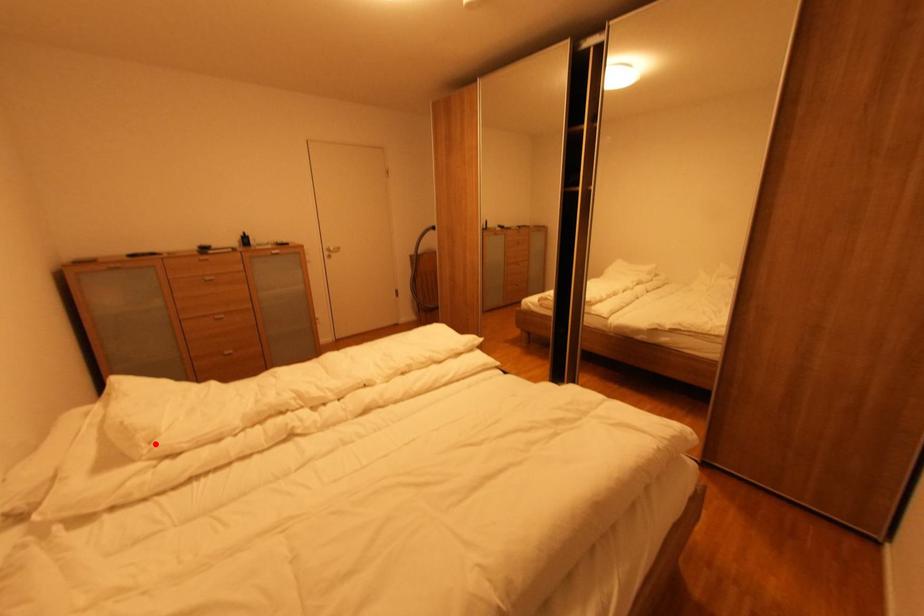
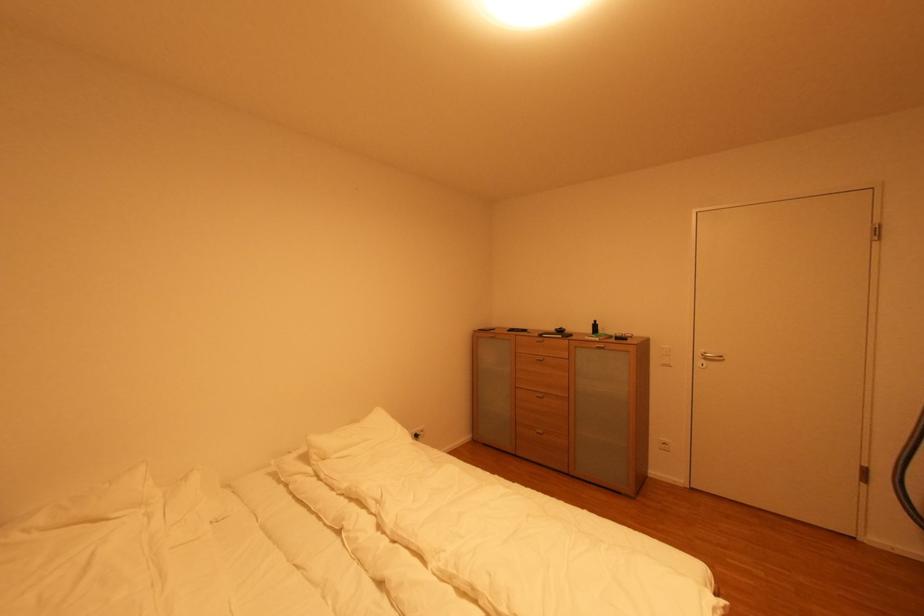
Locate, in the second image, the point that corresponds to the highlighted location in the first image.

(330, 461)